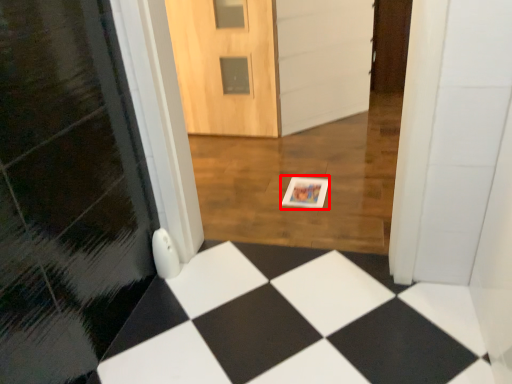
Question: Considering the relative positions of postcard (annotated by the red box) and door in the image provided, where is postcard (annotated by the red box) located with respect to the staircase?

Choices:
 (A) left
 (B) right

Answer: (B)